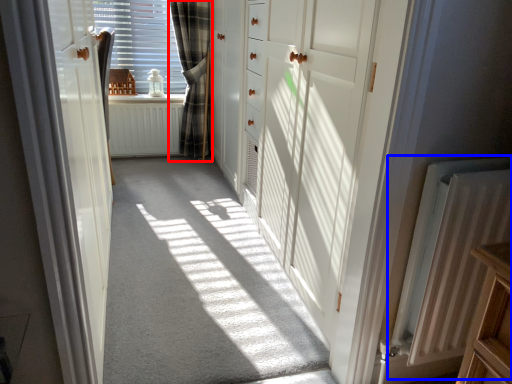
Question: Which object appears farthest to the camera in this image, curtain (highlighted by a red box) or radiator (highlighted by a blue box)?

Choices:
 (A) curtain
 (B) radiator

Answer: (A)